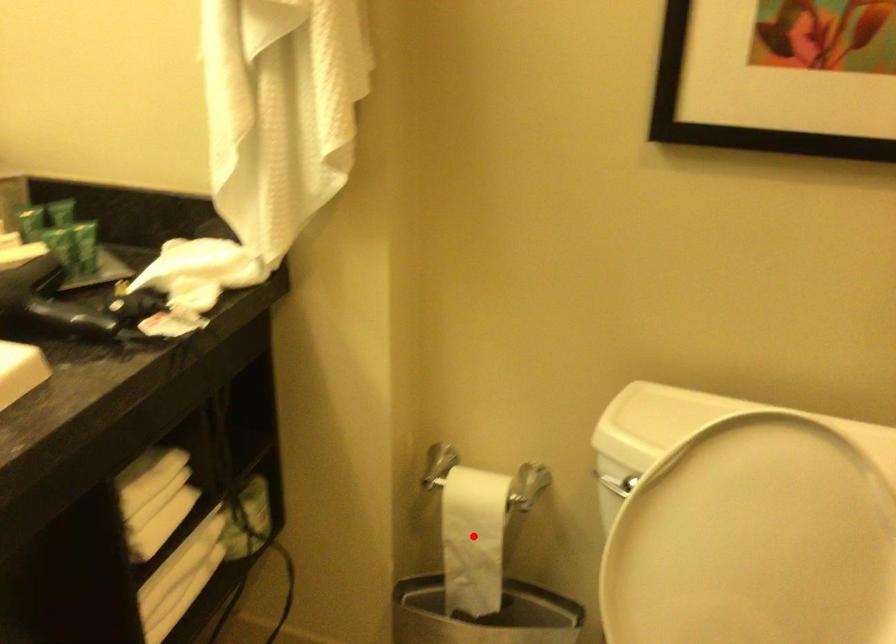
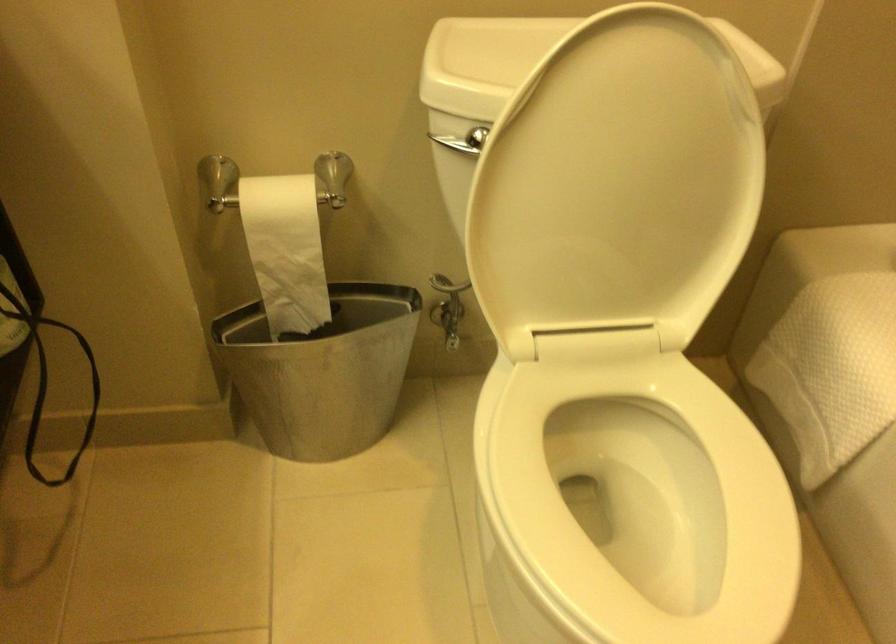
Find the pixel in the second image that matches the highlighted location in the first image.

(286, 250)